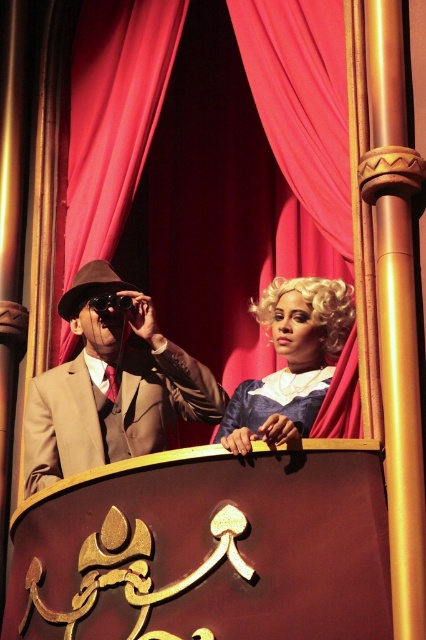
Between red velvet curtain at upper center and blonde wig at center, which one has more height?

red velvet curtain at upper center

Is red velvet curtain at upper center taller than blonde wig at center?

Indeed, red velvet curtain at upper center has a greater height compared to blonde wig at center.

Is point (201, 332) behind point (291, 326)?

Yes, point (201, 332) is farther from viewer.

You are a GUI agent. You are given a task and a screenshot of the screen. Output one action in this format:
    pyautogui.click(x=<x>, y=<y>)
    Task: Click on the red velvet curtain at upper center
    This screenshot has width=426, height=640.
    Given the screenshot: What is the action you would take?
    pyautogui.click(x=213, y=156)

Measure the distance between matte brown suit at left and camera.

matte brown suit at left and camera are 47.12 meters apart.

Identify the location of matte brown suit at left. The height and width of the screenshot is (640, 426). (111, 387).

What do you see at coordinates (111, 387) in the screenshot?
I see `matte brown suit at left` at bounding box center [111, 387].

The height and width of the screenshot is (640, 426). Find the location of `matte brown suit at left`. matte brown suit at left is located at coordinates (111, 387).

Does matte brown suit at left appear over blonde wig at center?

Incorrect, matte brown suit at left is not positioned above blonde wig at center.

Identify the location of matte brown suit at left. (111, 387).

The width and height of the screenshot is (426, 640). Identify the location of matte brown suit at left. (111, 387).